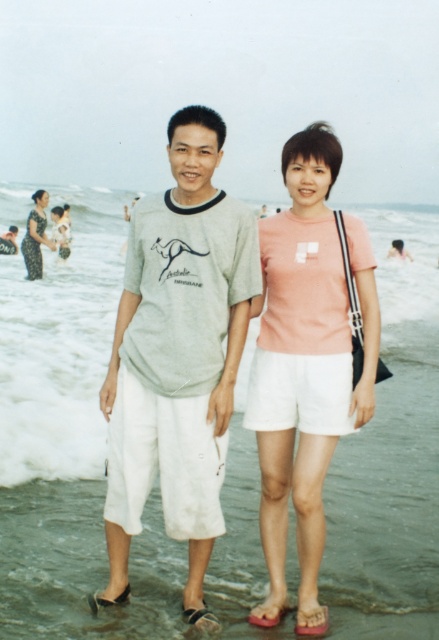
Does light gray cotton t-shirt at center have a larger size compared to brown leather sandal at lower center?

Yes.

Find the location of a particular element. light gray cotton t-shirt at center is located at coordinates (177, 355).

This screenshot has width=439, height=640. Find the location of `light gray cotton t-shirt at center`. light gray cotton t-shirt at center is located at coordinates (177, 355).

In the scene shown: Between light gray cotton t-shirt at center and black leather sandal at lower left, which one appears on the left side from the viewer's perspective?

Positioned to the left is black leather sandal at lower left.

What do you see at coordinates (177, 355) in the screenshot? Image resolution: width=439 pixels, height=640 pixels. I see `light gray cotton t-shirt at center` at bounding box center [177, 355].

Identify the location of light gray cotton t-shirt at center. (177, 355).

Is printed fabric dress at left smaller than black leather sandal at lower left?

Actually, printed fabric dress at left might be larger than black leather sandal at lower left.

Who is more forward, [33,237] or [125,595]?

Point [125,595] is more forward.

The height and width of the screenshot is (640, 439). In order to click on printed fabric dress at left in this screenshot , I will do `click(35, 236)`.